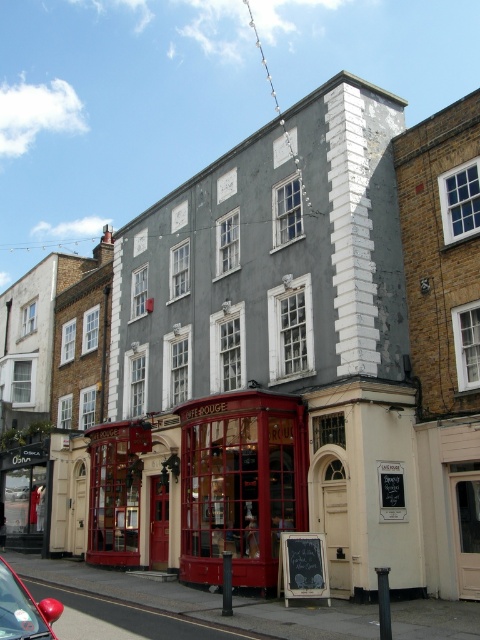
Question: Is red glass storefront at center to the right of shiny red car at lower left from the viewer's perspective?

Choices:
 (A) no
 (B) yes

Answer: (B)

Question: Among these points, which one is farthest from the camera?

Choices:
 (A) (250, 458)
 (B) (22, 602)

Answer: (A)

Question: Which point is closer to the camera?

Choices:
 (A) red glass storefront at center
 (B) shiny red car at lower left

Answer: (B)

Question: Does red glass storefront at center have a lesser width compared to shiny red car at lower left?

Choices:
 (A) yes
 (B) no

Answer: (B)

Question: Which point is closer to the camera?

Choices:
 (A) red glass storefront at center
 (B) shiny red car at lower left

Answer: (B)

Question: Is red glass storefront at center further to the viewer compared to shiny red car at lower left?

Choices:
 (A) yes
 (B) no

Answer: (A)